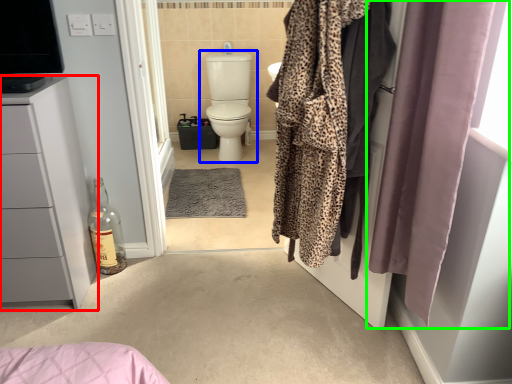
Question: Considering the real-world distances, which object is closest to bathroom cabinet (highlighted by a red box)? toilet (highlighted by a blue box) or curtain (highlighted by a green box).

Choices:
 (A) toilet
 (B) curtain

Answer: (B)